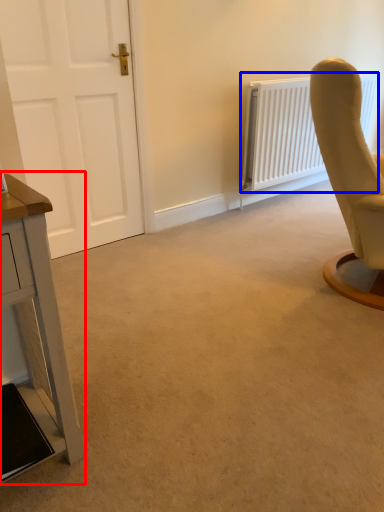
Question: Among these objects, which one is nearest to the camera, table (highlighted by a red box) or radiator (highlighted by a blue box)?

Choices:
 (A) table
 (B) radiator

Answer: (A)